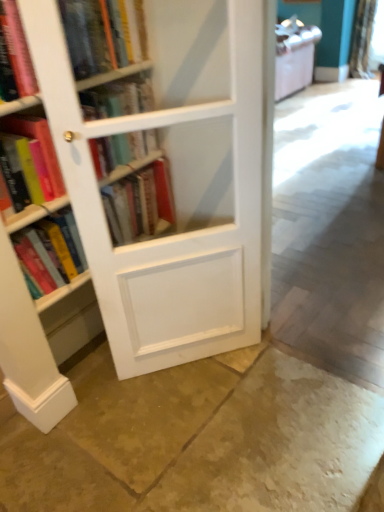
Locate an element on the screen. The image size is (384, 512). vacant location below white wood bookcase at left (from a real-world perspective) is located at coordinates (195, 362).